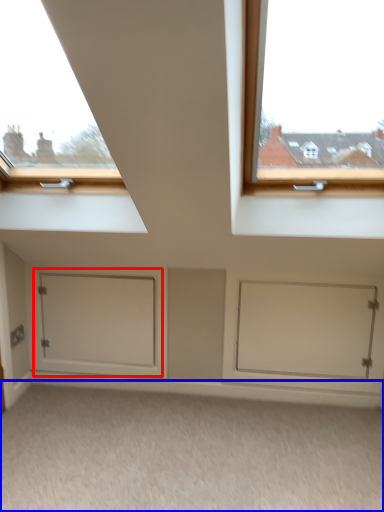
Question: Which object is further to the camera taking this photo, door (highlighted by a red box) or plain (highlighted by a blue box)?

Choices:
 (A) door
 (B) plain

Answer: (A)